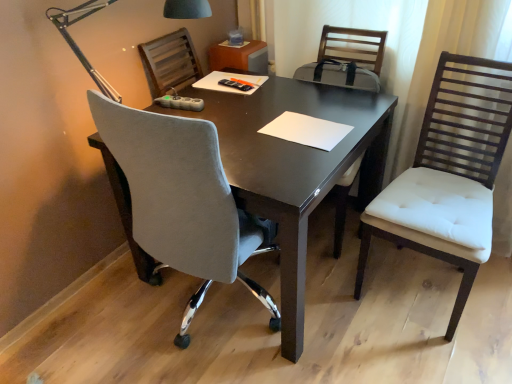
Question: Does point (138, 205) appear closer or farther from the camera than point (84, 59)?

Choices:
 (A) closer
 (B) farther

Answer: (B)

Question: Is velvet grey chair at center, acting as the second chair starting from the right, bigger or smaller than metallic gray lamp at upper left?

Choices:
 (A) big
 (B) small

Answer: (A)

Question: Which object is positioned farthest from the velvet grey chair at center, which ranks as the 1th chair in left-to-right order?

Choices:
 (A) metallic gray lamp at upper left
 (B) white tufted armchair at center
 (C) white paper at center
 (D) white tufted cushion chair at right, which is the second chair in left-to-right order

Answer: (B)

Question: Which object is positioned closest to the white tufted cushion chair at right, acting as the 1th chair starting from the right?

Choices:
 (A) velvet grey chair at center, acting as the second chair starting from the right
 (B) white paper at center
 (C) white tufted armchair at center
 (D) metallic gray lamp at upper left

Answer: (B)